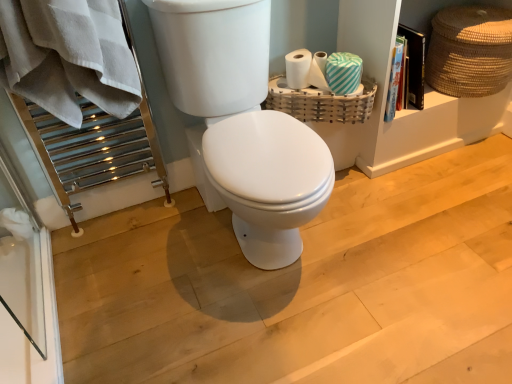
Question: Is white cotton bath towel at left wider than braided straw basket at upper right, the 2th basket viewed from the left?

Choices:
 (A) yes
 (B) no

Answer: (A)

Question: From the image's perspective, is white cotton bath towel at left above braided straw basket at upper right, which is the 1th basket in right-to-left order?

Choices:
 (A) no
 (B) yes

Answer: (A)

Question: Is white cotton bath towel at left surrounding braided straw basket at upper right, which is the 1th basket in right-to-left order?

Choices:
 (A) yes
 (B) no

Answer: (B)

Question: Is white cotton bath towel at left next to braided straw basket at upper right, which is the 1th basket in right-to-left order?

Choices:
 (A) no
 (B) yes

Answer: (A)

Question: Is white cotton bath towel at left not close to braided straw basket at upper right, the 2th basket viewed from the left?

Choices:
 (A) yes
 (B) no

Answer: (A)

Question: Is white cotton bath towel at left to the right of braided straw basket at upper right, the 2th basket viewed from the left, from the viewer's perspective?

Choices:
 (A) no
 (B) yes

Answer: (A)

Question: From a real-world perspective, is white glossy toilet at center located beneath white cotton bath towel at left?

Choices:
 (A) no
 (B) yes

Answer: (B)

Question: Is white glossy toilet at center directly adjacent to white cotton bath towel at left?

Choices:
 (A) yes
 (B) no

Answer: (B)

Question: From a real-world perspective, is white glossy toilet at center positioned over white cotton bath towel at left based on gravity?

Choices:
 (A) no
 (B) yes

Answer: (A)

Question: Is white glossy toilet at center not inside white cotton bath towel at left?

Choices:
 (A) yes
 (B) no

Answer: (A)

Question: Is white glossy toilet at center at the right side of white cotton bath towel at left?

Choices:
 (A) no
 (B) yes

Answer: (B)

Question: Is white cotton bath towel at left surrounded by white glossy toilet at center?

Choices:
 (A) no
 (B) yes

Answer: (A)

Question: From a real-world perspective, is braided straw basket at upper right, the 2th basket viewed from the left, physically above white glossy toilet at center?

Choices:
 (A) yes
 (B) no

Answer: (B)